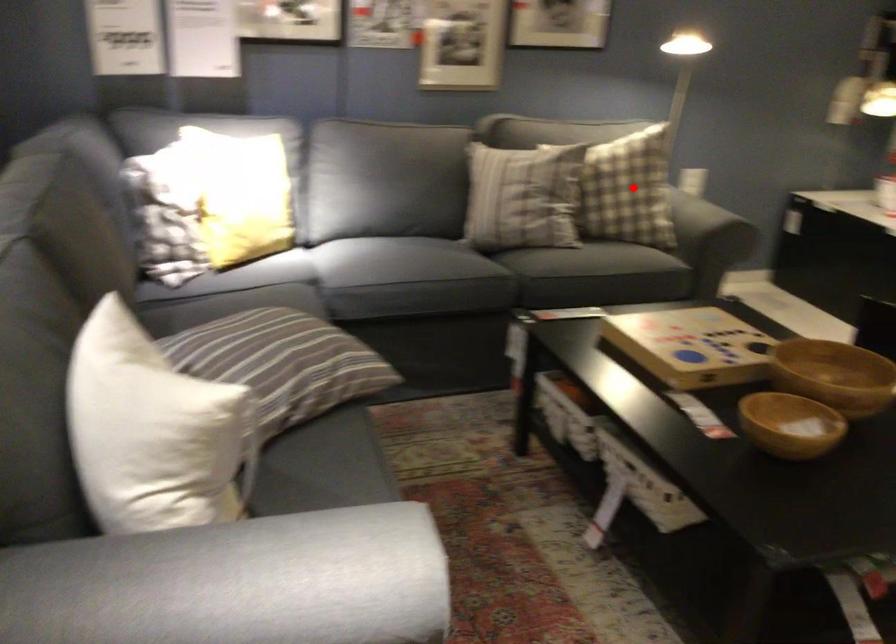
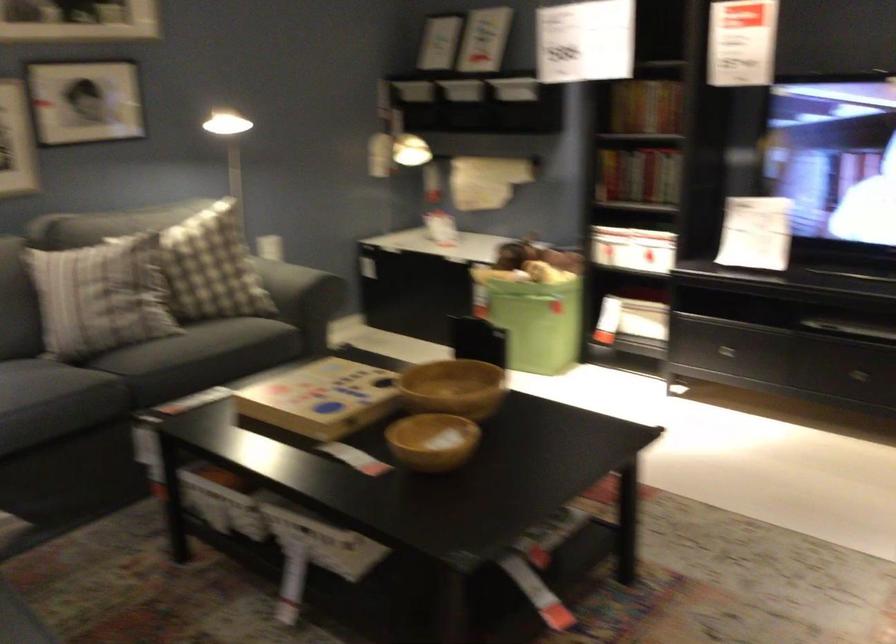
The point at the highlighted location is marked in the first image. Where is the corresponding point in the second image?

(211, 267)